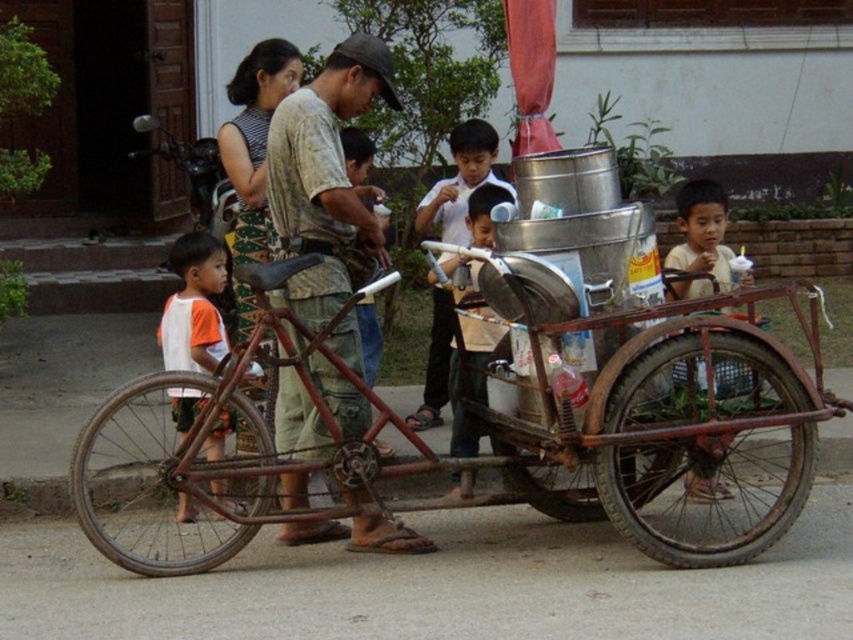
Can you confirm if rusty metal tricycle at center is bigger than rusty metal bicycle at center?

Yes, rusty metal tricycle at center is bigger than rusty metal bicycle at center.

Is point (427, 465) positioned before point (323, 284)?

Yes.

Does point (573, 520) come behind point (332, 122)?

Yes, point (573, 520) is farther from viewer.

Where is `rusty metal tricycle at center`? This screenshot has height=640, width=853. rusty metal tricycle at center is located at coordinates (451, 458).

Can you confirm if rusty metal bicycle at center is thinner than matte yellow shirt at right?

In fact, rusty metal bicycle at center might be wider than matte yellow shirt at right.

Does rusty metal bicycle at center have a greater width compared to matte yellow shirt at right?

Correct, the width of rusty metal bicycle at center exceeds that of matte yellow shirt at right.

This screenshot has width=853, height=640. In order to click on rusty metal bicycle at center in this screenshot , I will do 325,179.

Can you confirm if rusty metal bicycle at center is wider than white cotton shirt at left?

Yes, rusty metal bicycle at center is wider than white cotton shirt at left.

Based on the photo, is rusty metal bicycle at center to the left of white cotton shirt at left from the viewer's perspective?

No, rusty metal bicycle at center is not to the left of white cotton shirt at left.

What do you see at coordinates (325, 179) in the screenshot?
I see `rusty metal bicycle at center` at bounding box center [325, 179].

Locate an element on the screen. Image resolution: width=853 pixels, height=640 pixels. rusty metal bicycle at center is located at coordinates (325, 179).